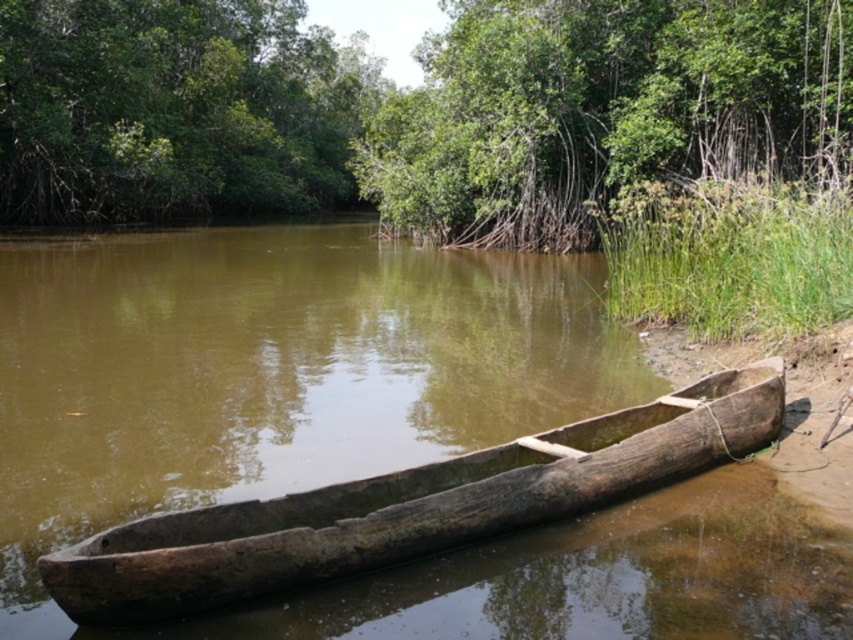
Question: Which point appears closest to the camera in this image?

Choices:
 (A) (584, 506)
 (B) (224, 60)

Answer: (A)

Question: Can you confirm if green leafy tree at upper center is positioned to the right of green leafy trees at upper left?

Choices:
 (A) no
 (B) yes

Answer: (B)

Question: Which object is the closest to the dark brown wood canoe at center?

Choices:
 (A) green leafy tree at upper center
 (B) green leafy trees at upper left

Answer: (A)

Question: Does green leafy trees at upper left have a lesser width compared to dark brown wood canoe at center?

Choices:
 (A) no
 (B) yes

Answer: (A)

Question: Which point is closer to the camera?

Choices:
 (A) (137, 528)
 (B) (781, 19)

Answer: (A)

Question: From the image, what is the correct spatial relationship of green leafy tree at upper center in relation to dark brown wood canoe at center?

Choices:
 (A) right
 (B) left

Answer: (A)